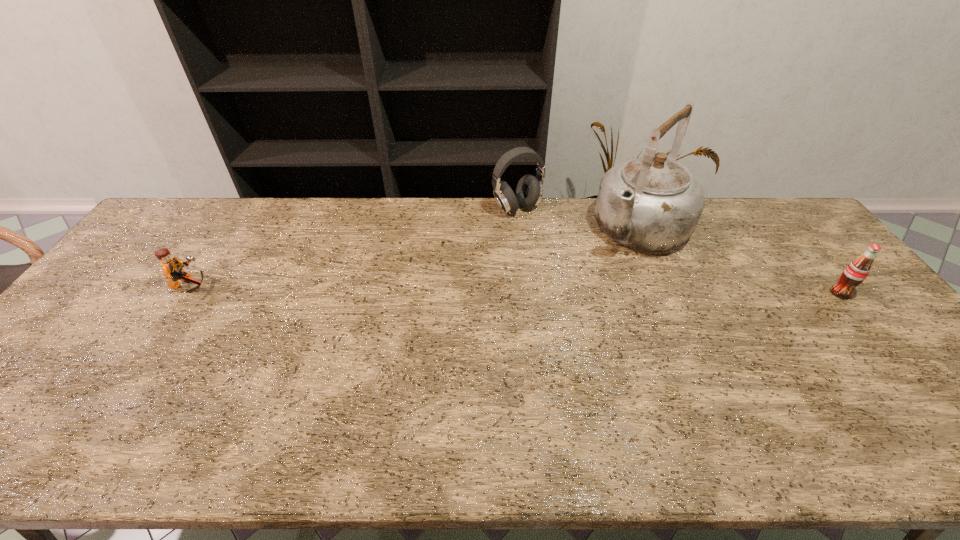
At what (x,y) coordinates should I click in order to perform the action: click on Lego. Please return your answer as a coordinate pair (x, y). The width and height of the screenshot is (960, 540). Looking at the image, I should click on (171, 266).

Locate an element on the screen. The image size is (960, 540). the shortest object is located at coordinates (171, 266).

This screenshot has height=540, width=960. I want to click on the rightmost object, so click(855, 273).

Locate an element on the screen. The width and height of the screenshot is (960, 540). soda is located at coordinates (855, 273).

Locate an element on the screen. The width and height of the screenshot is (960, 540). the third object from right to left is located at coordinates (529, 190).

Where is `the third shortest object`? This screenshot has width=960, height=540. the third shortest object is located at coordinates (529, 190).

Identify the location of kettle. The image size is (960, 540). (650, 203).

Find the location of a particular element. Image resolution: width=960 pixels, height=540 pixels. the tallest object is located at coordinates (650, 203).

This screenshot has width=960, height=540. I want to click on vacant space located holding a crossbow in the hands of the Lego, so [x=318, y=287].

Where is `vacant space situated 0.330m on the left of the second shortest object`? vacant space situated 0.330m on the left of the second shortest object is located at coordinates (715, 293).